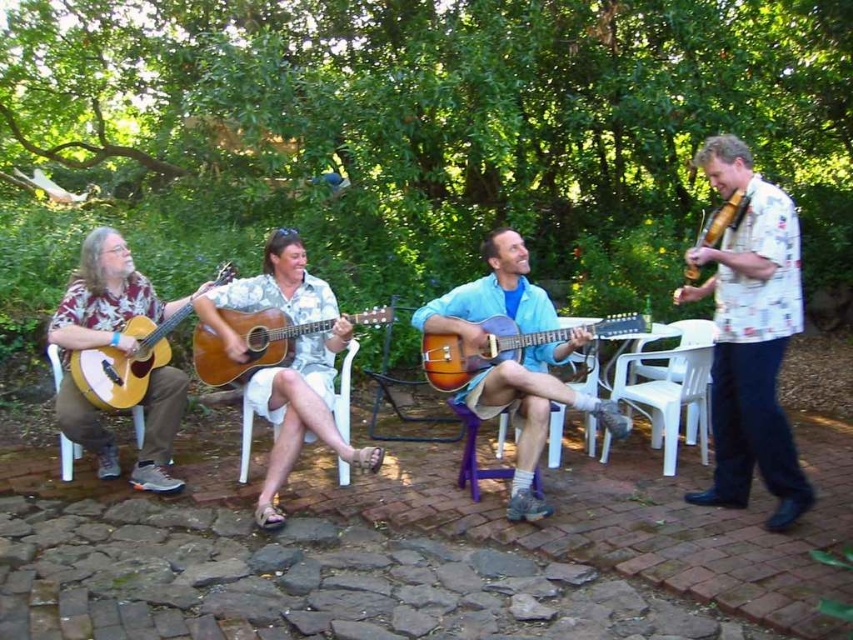
Which is behind, point (519, 348) or point (165, 340)?

The point (165, 340) is behind.

Consider the image. Can you confirm if sunburst wood guitar at center is positioned above matte wood guitar at left?

Incorrect, sunburst wood guitar at center is not positioned above matte wood guitar at left.

What are the coordinates of `sunburst wood guitar at center` in the screenshot? It's located at (479, 349).

This screenshot has width=853, height=640. What are the coordinates of `sunburst wood guitar at center` in the screenshot? It's located at (479, 349).

Between white plastic chair at center and white plastic chair at left, which one appears on the left side from the viewer's perspective?

Positioned to the left is white plastic chair at left.

Between white plastic chair at center and white plastic chair at left, which one is positioned lower?

white plastic chair at left

Looking at this image, who is more distant from viewer, (347, 358) or (56, 349)?

Positioned behind is point (347, 358).

What are the coordinates of `white plastic chair at center` in the screenshot? It's located at (344, 392).

Does point (653, 371) come farther from viewer compared to point (314, 326)?

Yes.

Does point (660, 372) lie in front of point (305, 330)?

No.

The height and width of the screenshot is (640, 853). What do you see at coordinates (670, 390) in the screenshot?
I see `white plastic chair at right` at bounding box center [670, 390].

What are the coordinates of `white plastic chair at right` in the screenshot? It's located at (670, 390).